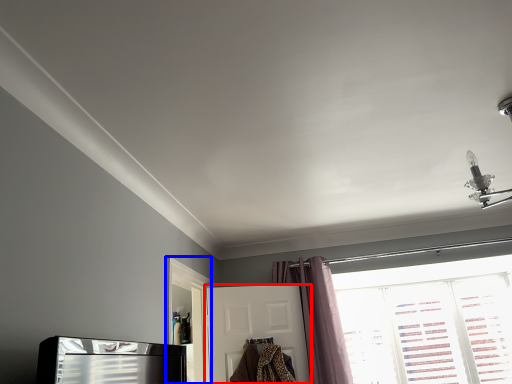
Question: Which object appears farthest to the camera in this image, door (highlighted by a red box) or screen door (highlighted by a blue box)?

Choices:
 (A) door
 (B) screen door

Answer: (A)